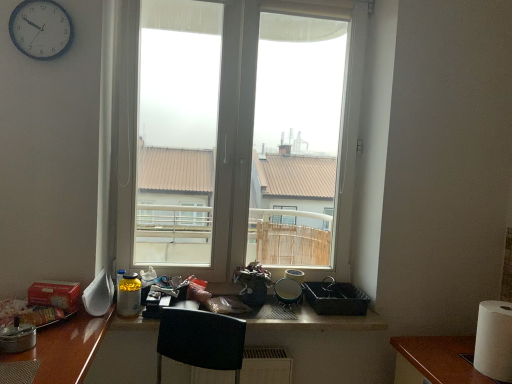
Where is `black woven basket at lower right, positioned as the fourth appliance in front-to-back order`? black woven basket at lower right, positioned as the fourth appliance in front-to-back order is located at coordinates (335, 298).

Image resolution: width=512 pixels, height=384 pixels. What do you see at coordinates (41, 29) in the screenshot?
I see `white plastic clock at upper left` at bounding box center [41, 29].

What do you see at coordinates (288, 292) in the screenshot? The image size is (512, 384). I see `metallic silver frying pan at center, positioned as the third appliance in left-to-right order` at bounding box center [288, 292].

I want to click on white paper at right, so click(x=494, y=340).

The width and height of the screenshot is (512, 384). Identify the location of metallic silver pot at left, which is the first appliance in front-to-back order. (17, 337).

Where is `black woven basket at lower right, positioned as the fourth appliance in front-to-back order`? Image resolution: width=512 pixels, height=384 pixels. black woven basket at lower right, positioned as the fourth appliance in front-to-back order is located at coordinates (335, 298).

Can you confirm if white paper at right is bigger than transparent glass window at center?

No, white paper at right is not bigger than transparent glass window at center.

Could you tell me if white paper at right is facing transparent glass window at center?

No, white paper at right is not facing towards transparent glass window at center.

From a real-world perspective, which object rests below the other?

white paper at right.

The width and height of the screenshot is (512, 384). There is a white paper at right. Find the location of `window above it (from a real-world perspective)`. window above it (from a real-world perspective) is located at coordinates (234, 135).

Is point (36, 15) positioned in front of point (25, 323)?

No, (36, 15) is further to viewer.

Is white plastic clock at upper left smaller than metallic silver pot at left, positioned as the 4th appliance in back-to-front order?

No, white plastic clock at upper left is not smaller than metallic silver pot at left, positioned as the 4th appliance in back-to-front order.

Locate an element on the screen. The image size is (512, 384). the 1st appliance to the right of the white plastic clock at upper left, counting from the anchor's position is located at coordinates (17, 337).

Is white plastic clock at upper left taller or shorter than metallic silver pot at left, positioned as the 4th appliance in back-to-front order?

Clearly, white plastic clock at upper left is taller compared to metallic silver pot at left, positioned as the 4th appliance in back-to-front order.

Does black woven basket at lower right, which is the first appliance in back-to-front order, appear on the right side of white paper at right?

In fact, black woven basket at lower right, which is the first appliance in back-to-front order, is to the left of white paper at right.

From the image's perspective, which one is positioned higher, black woven basket at lower right, which is counted as the 1th appliance, starting from the right, or white paper at right?

black woven basket at lower right, which is counted as the 1th appliance, starting from the right, is shown above in the image.

Between black woven basket at lower right, positioned as the fourth appliance in front-to-back order, and white paper at right, which one is positioned in front?

Positioned in front is white paper at right.

Between black woven basket at lower right, positioned as the fourth appliance in front-to-back order, and metallic silver pot at left, positioned as the 4th appliance in back-to-front order, which one has larger size?

black woven basket at lower right, positioned as the fourth appliance in front-to-back order, is bigger.

From the image's perspective, which object appears higher, black woven basket at lower right, which is the first appliance in back-to-front order, or metallic silver pot at left, which is the first appliance in front-to-back order?

metallic silver pot at left, which is the first appliance in front-to-back order, from the image's perspective.

How much distance is there between black woven basket at lower right, positioned as the fourth appliance in front-to-back order, and metallic silver pot at left, the 1th appliance viewed from the left?

black woven basket at lower right, positioned as the fourth appliance in front-to-back order, is 3.85 feet from metallic silver pot at left, the 1th appliance viewed from the left.

There is a metallic silver pot at left, positioned as the 4th appliance in back-to-front order. Identify the location of the 2nd appliance below it (from the image's perspective). The height and width of the screenshot is (384, 512). (335, 298).

Locate an element on the screen. Image resolution: width=512 pixels, height=384 pixels. window that appears above the metallic silver pot at left, positioned as the 4th appliance in back-to-front order (from a real-world perspective) is located at coordinates (234, 135).

Which object is further away from the camera, transparent glass window at center or metallic silver pot at left, which is the first appliance in front-to-back order?

transparent glass window at center is more distant.

Is transparent glass window at center far from metallic silver pot at left, the 1th appliance viewed from the left?

Absolutely, transparent glass window at center is distant from metallic silver pot at left, the 1th appliance viewed from the left.

Which object is positioned more to the right, transparent glass window at center or metallic silver pot at left, positioned as the 4th appliance in back-to-front order?

transparent glass window at center.

Does metallic silver pot at left, the 1th appliance viewed from the left, turn towards translucent plastic bottle at lower left?

No, metallic silver pot at left, the 1th appliance viewed from the left, is not turned towards translucent plastic bottle at lower left.

Does point (22, 341) appear closer or farther from the camera than point (138, 309)?

Point (22, 341) is positioned closer to the camera compared to point (138, 309).

How many degrees apart are the facing directions of metallic silver pot at left, positioned as the 4th appliance in back-to-front order, and translucent plastic bottle at lower left?

They differ by 6.85 degrees in their facing directions.

Does metallic silver pot at left, positioned as the fourth appliance in right-to-left order, have a larger size compared to translucent plastic bottle at lower left?

Actually, metallic silver pot at left, positioned as the fourth appliance in right-to-left order, might be smaller than translucent plastic bottle at lower left.

Considering the positions of point (133, 316) and point (230, 148), is point (133, 316) closer or farther from the camera than point (230, 148)?

Clearly, point (133, 316) is closer to the camera than point (230, 148).

Measure the distance between translucent plastic bottle at lower left and transparent glass window at center.

translucent plastic bottle at lower left and transparent glass window at center are 3.82 meters apart from each other.

Considering the relative sizes of translucent plastic bottle at lower left and transparent glass window at center in the image provided, is translucent plastic bottle at lower left shorter than transparent glass window at center?

Yes, translucent plastic bottle at lower left is shorter than transparent glass window at center.

Which object is positioned more to the right, translucent plastic bottle at lower left or transparent glass window at center?

transparent glass window at center.

Where is `paper towel on the right of transparent glass window at center`? The width and height of the screenshot is (512, 384). paper towel on the right of transparent glass window at center is located at coordinates (494, 340).

Identify the location of clock behind the metallic silver pot at left, positioned as the 4th appliance in back-to-front order. This screenshot has height=384, width=512. (41, 29).

When comparing their distances from metallic silver pot at left, which is the first appliance in front-to-back order, does white glossy spoon at left, marked as the 2th appliance in a left-to-right arrangement, or metallic silver frying pan at center, which is the 2th appliance from right to left, seem closer?

The object closer to metallic silver pot at left, which is the first appliance in front-to-back order, is white glossy spoon at left, marked as the 2th appliance in a left-to-right arrangement.

Estimate the real-world distances between objects in this image. Which object is further from metallic silver frying pan at center, which is counted as the second appliance, starting from the back, transparent glass window at center or white plastic clock at upper left?

transparent glass window at center lies further to metallic silver frying pan at center, which is counted as the second appliance, starting from the back, than the other object.

Based on their spatial positions, is black woven basket at lower right, the 4th appliance positioned from the left, or white paper at right closer to translucent plastic bottle at lower left?

Result: black woven basket at lower right, the 4th appliance positioned from the left, is closer to translucent plastic bottle at lower left.

From the image, which object appears to be nearer to white plastic clock at upper left, white glossy spoon at left, marked as the 2th appliance in a left-to-right arrangement, or metallic silver frying pan at center, which is the 2th appliance from right to left?

white glossy spoon at left, marked as the 2th appliance in a left-to-right arrangement, is positioned closer to the anchor white plastic clock at upper left.

Looking at this image, based on their spatial positions, is white plastic clock at upper left or white paper at right further from black woven basket at lower right, positioned as the fourth appliance in front-to-back order?

Among the two, white plastic clock at upper left is located further to black woven basket at lower right, positioned as the fourth appliance in front-to-back order.

Consider the image. From the image, which object appears to be nearer to metallic silver pot at left, the 1th appliance viewed from the left, white plastic clock at upper left or metallic silver frying pan at center, positioned as the third appliance in left-to-right order?

white plastic clock at upper left lies closer to metallic silver pot at left, the 1th appliance viewed from the left, than the other object.

When comparing their distances from metallic silver pot at left, which is the first appliance in front-to-back order, does white glossy spoon at left, which appears as the second appliance when viewed from the front, or transparent glass window at center seem closer?

Based on the image, white glossy spoon at left, which appears as the second appliance when viewed from the front, appears to be nearer to metallic silver pot at left, which is the first appliance in front-to-back order.

Estimate the real-world distances between objects in this image. Which object is further from metallic silver pot at left, positioned as the 4th appliance in back-to-front order, black woven basket at lower right, which is counted as the 1th appliance, starting from the right, or white paper at right?

Among the two, white paper at right is located further to metallic silver pot at left, positioned as the 4th appliance in back-to-front order.

Find the location of a particular element. The height and width of the screenshot is (384, 512). window located between metallic silver pot at left, the 1th appliance viewed from the left, and metallic silver frying pan at center, which is counted as the second appliance, starting from the back, in the left-right direction is located at coordinates (234, 135).

At what (x,y) coordinates should I click in order to perform the action: click on window located between metallic silver pot at left, positioned as the 4th appliance in back-to-front order, and white paper at right in the left-right direction. Please return your answer as a coordinate pair (x, y). Looking at the image, I should click on (234, 135).

Where is `window located between white glossy spoon at left, which appears as the second appliance when viewed from the front, and white paper at right in the left-right direction`? The image size is (512, 384). window located between white glossy spoon at left, which appears as the second appliance when viewed from the front, and white paper at right in the left-right direction is located at coordinates point(234,135).

I want to click on bottle situated between white glossy spoon at left, marked as the 2th appliance in a left-to-right arrangement, and white paper at right from left to right, so click(128, 296).